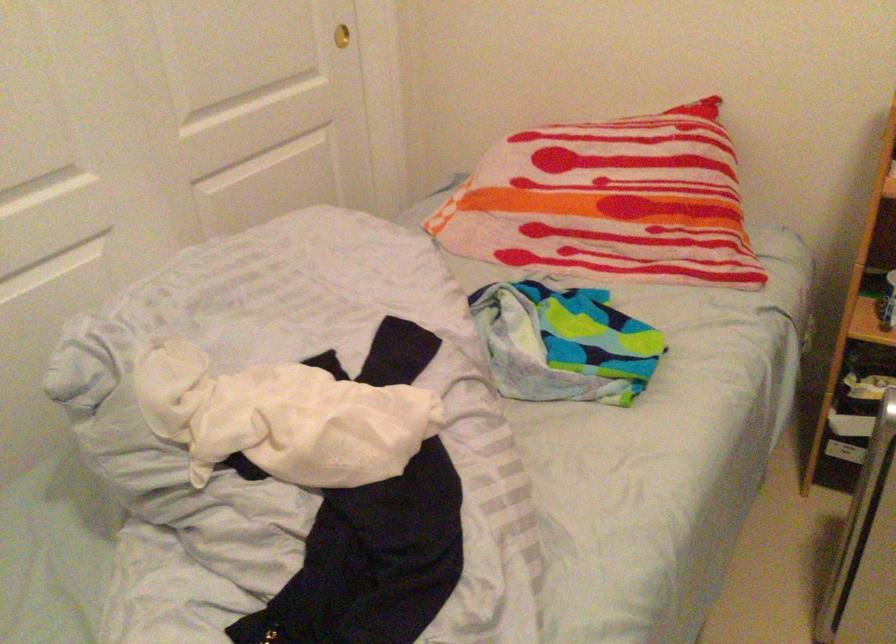
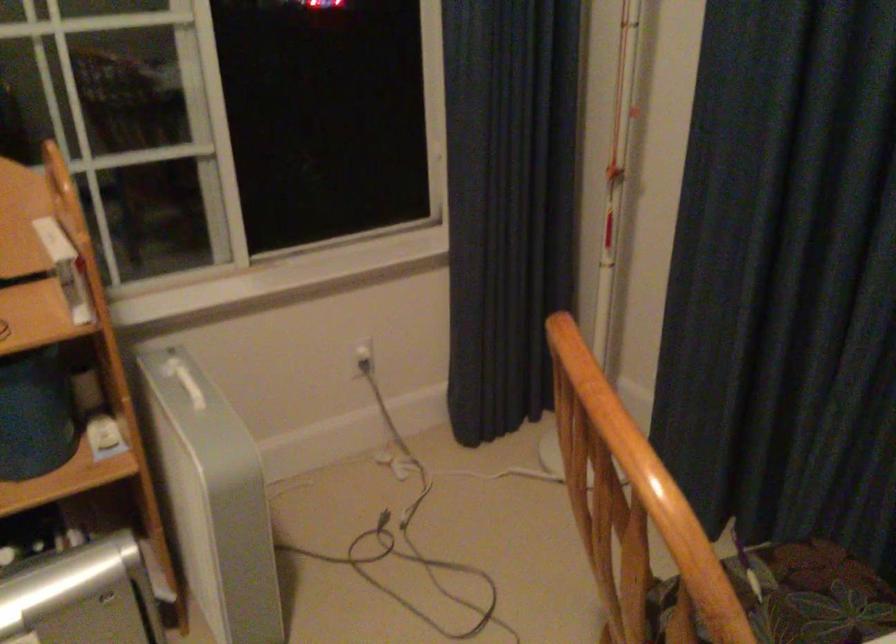
Question: The images are taken continuously from a first-person perspective. In which direction is your viewpoint rotating?

Choices:
 (A) Left
 (B) Right
 (C) Up
 (D) Down

Answer: (B)